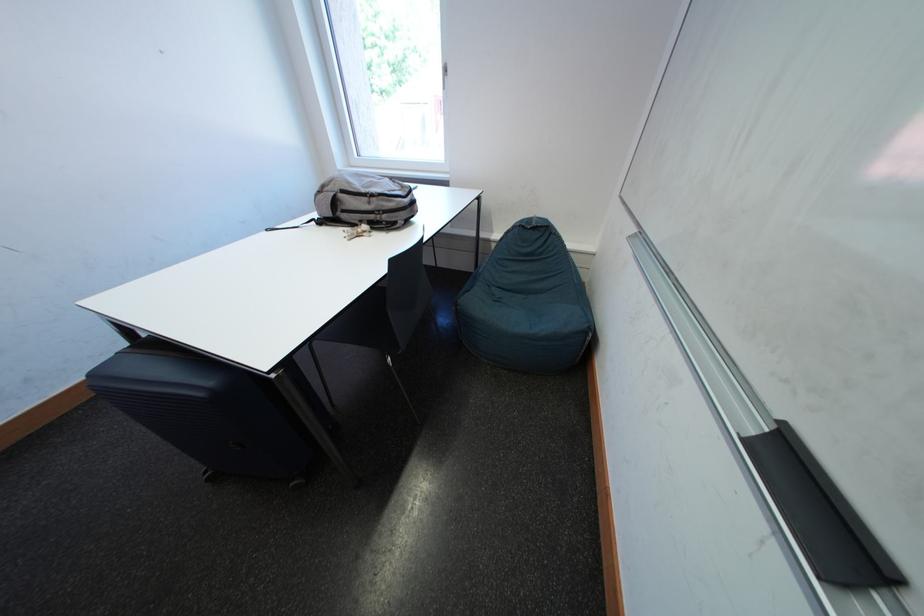
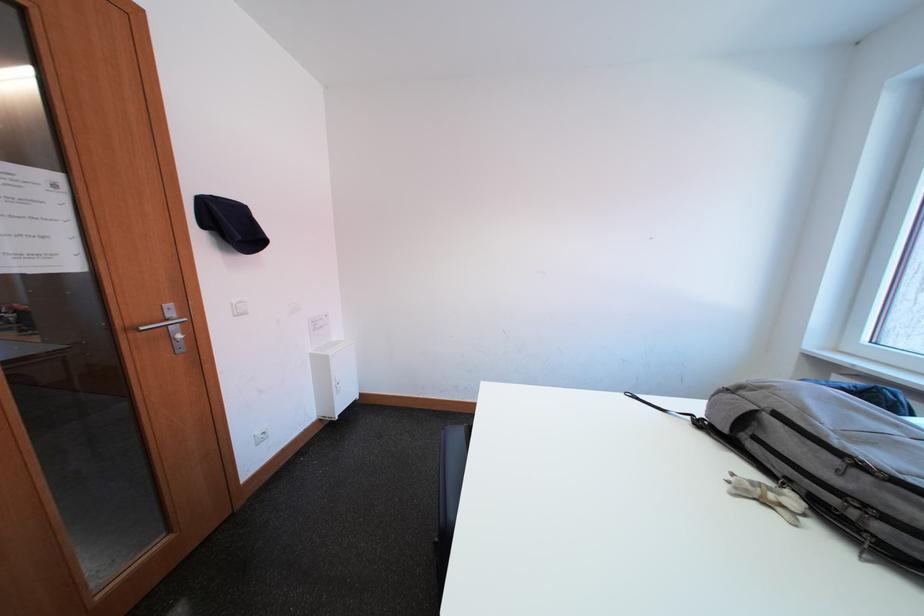
Question: The camera is either moving clockwise (left) or counter-clockwise (right) around the object. The first image is from the beginning of the video and the second image is from the end. Is the camera moving left or right when shooting the video?

Choices:
 (A) Left
 (B) Right

Answer: (B)